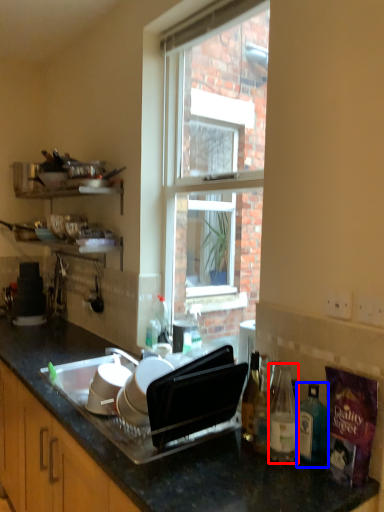
Question: Which of the following is the farthest to the observer, bottle (highlighted by a red box) or bottle (highlighted by a blue box)?

Choices:
 (A) bottle
 (B) bottle

Answer: (B)